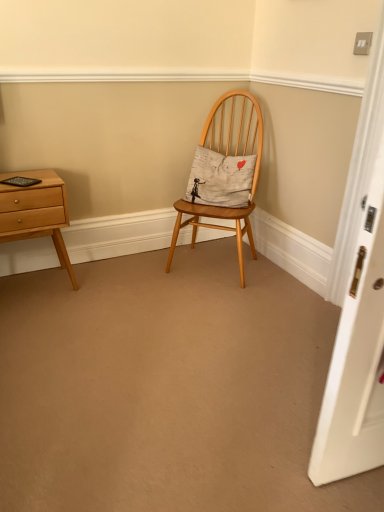
Question: Is light brown wood nightstand at left in front of or behind white cotton cushion at center in the image?

Choices:
 (A) front
 (B) behind

Answer: (A)

Question: Is point (43, 230) closer or farther from the camera than point (226, 158)?

Choices:
 (A) closer
 (B) farther

Answer: (A)

Question: Which is nearer to the white cotton cushion at center?

Choices:
 (A) natural wood chair at center
 (B) light brown wood nightstand at left

Answer: (A)

Question: Based on their relative distances, which object is farther from the light brown wood nightstand at left?

Choices:
 (A) white cotton cushion at center
 (B) natural wood chair at center

Answer: (A)